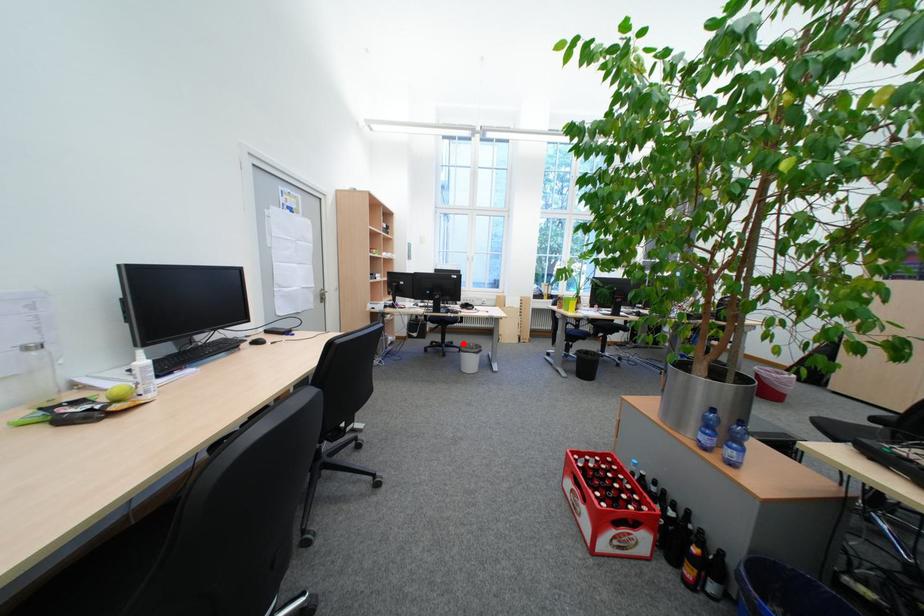
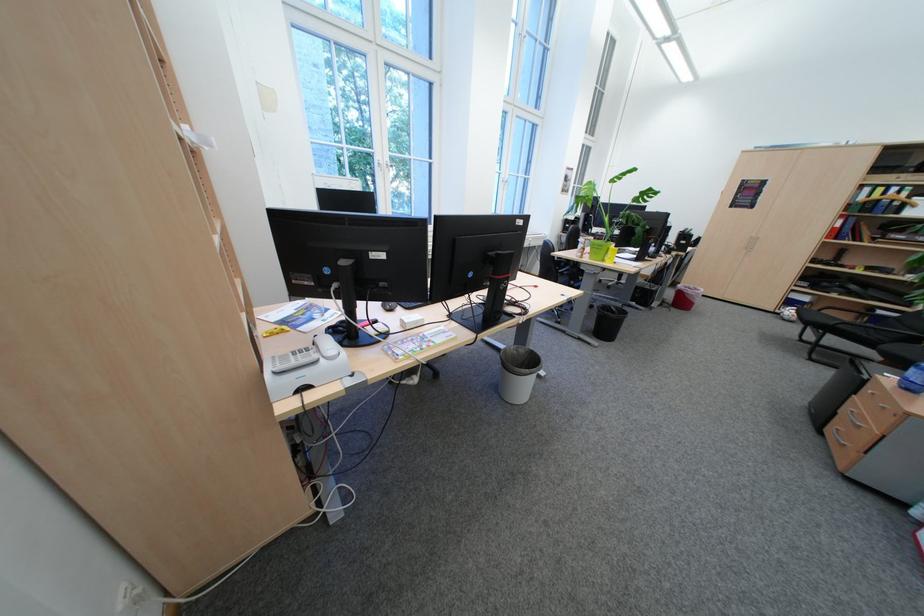
Question: I am providing you with two images of the same scene from different viewpoints. A red point is marked on the first image. At the location where the point appears in image 1, is it still visible in image 2?

Choices:
 (A) Yes
 (B) No

Answer: (B)